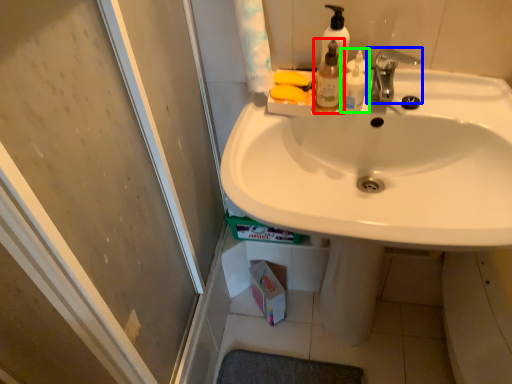
Question: Which object is positioned farthest from mouthwash (highlighted by a red box)? Select from tap (highlighted by a blue box) and mouthwash (highlighted by a green box).

Choices:
 (A) tap
 (B) mouthwash

Answer: (A)